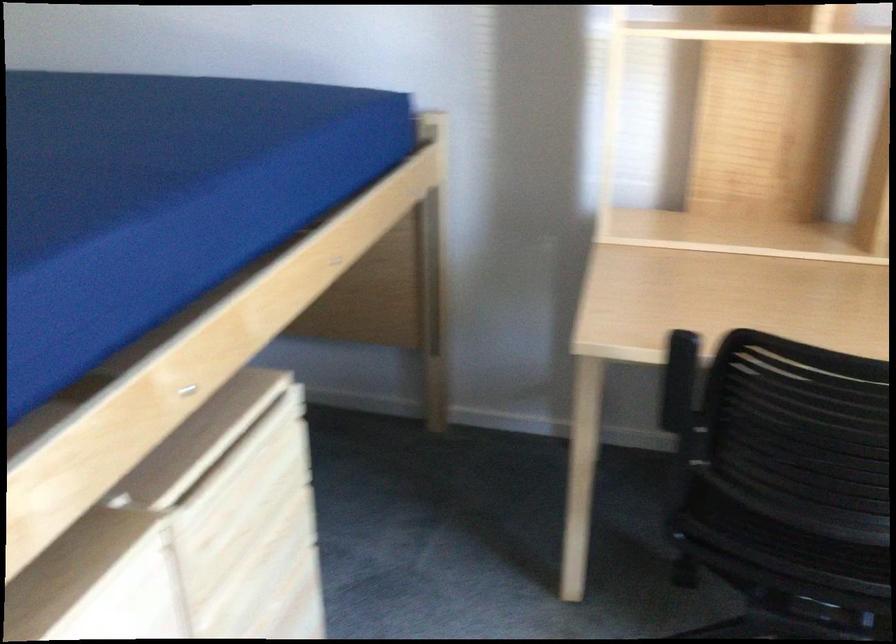
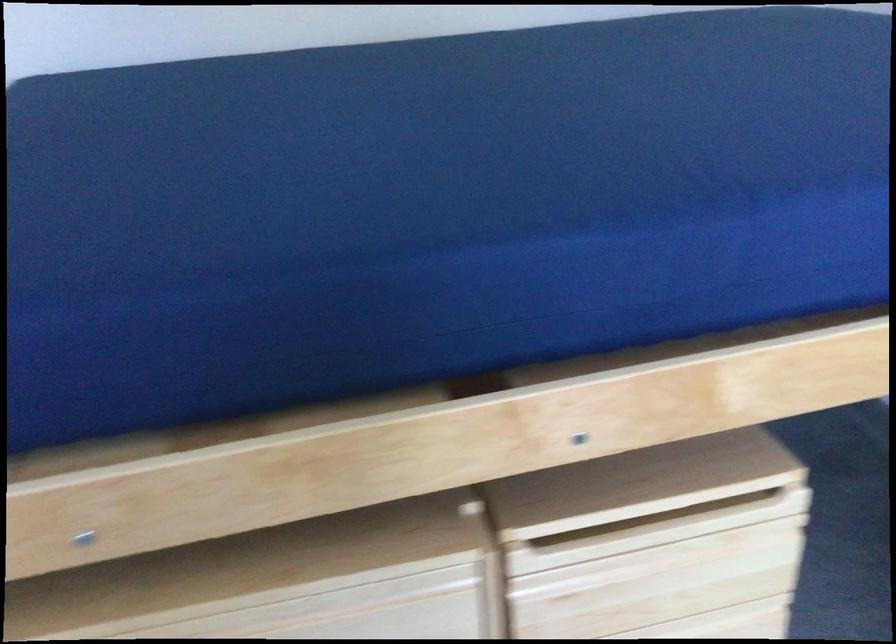
In the second image, find the point that corresponds to point (286, 523) in the first image.

(725, 623)